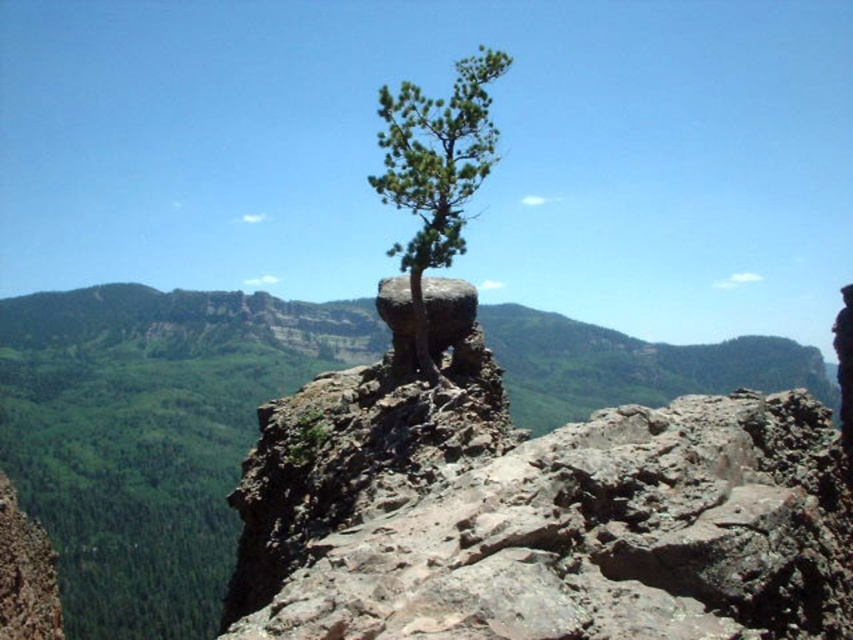
Looking at this image, you are a hiker standing at the base of the rugged landscape. You notice the green rough textured tree at center and the rusty rock at center. Which object is positioned higher from the ground?

The green rough textured tree at center is above the rusty rock at center, so it is positioned higher from the ground.

You are a hiker who wants to take a photo of the green rough textured tree at center and the rusty rock at center. From your current position, which object is closer to you?

The green rough textured tree at center is closer to you since it is in front of the rusty rock at center.

You are a hiker who wants to place a 20 feet long tent between the green rough textured tree at center and the rusty rock at center. Can you fit the tent between them without moving either object?

The distance between the green rough textured tree at center and the rusty rock at center is 22.07 feet. Since the tent is 20 feet long, it can fit between them with 2.07 feet of space remaining.